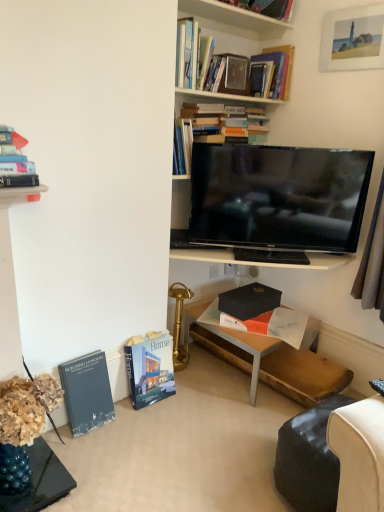
You are a GUI agent. You are given a task and a screenshot of the screen. Output one action in this format:
    pyautogui.click(x=<x>, y=<y>)
    Task: Click on the blank space situated above wooden bookshelf at upper center (from a real-world perspective)
    This screenshot has height=512, width=384.
    Given the screenshot: What is the action you would take?
    pyautogui.click(x=240, y=15)